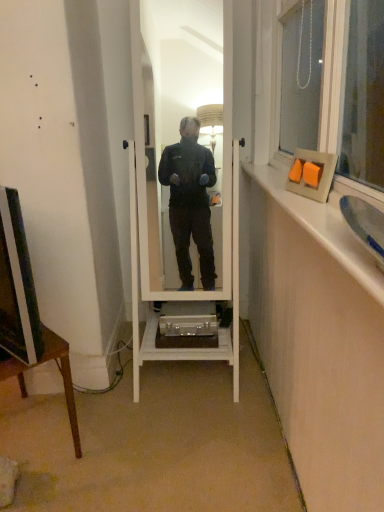
Locate an element on the screen. vacant space in front of white wooden mirror at center is located at coordinates (186, 435).